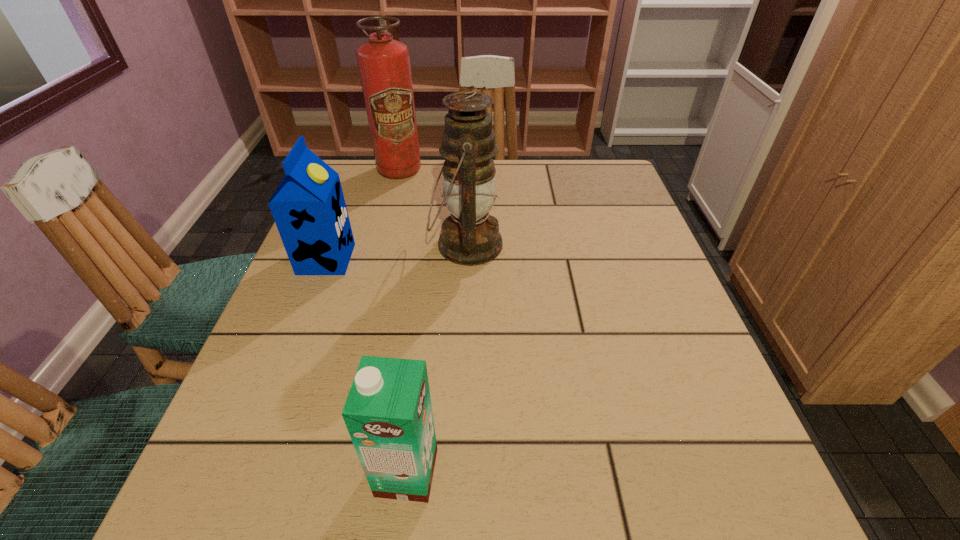
The image size is (960, 540). What are the coordinates of `object situated at the near edge` in the screenshot? It's located at (388, 413).

You are a GUI agent. You are given a task and a screenshot of the screen. Output one action in this format:
    pyautogui.click(x=<x>, y=<y>)
    Task: Click on the fire extinguisher present at the left edge
    The height and width of the screenshot is (540, 960).
    Given the screenshot: What is the action you would take?
    pyautogui.click(x=384, y=65)

I want to click on carton at the left edge, so click(308, 207).

At what (x,y) coordinates should I click in order to perform the action: click on object that is at the far left corner. Please return your answer as a coordinate pair (x, y). Looking at the image, I should click on (384, 65).

Where is `free space at the far edge of the desktop`? free space at the far edge of the desktop is located at coordinates (550, 177).

Where is `vacant space at the near edge`? Image resolution: width=960 pixels, height=540 pixels. vacant space at the near edge is located at coordinates (438, 515).

The height and width of the screenshot is (540, 960). I want to click on free space at the left edge of the desktop, so click(x=252, y=381).

In the image, there is a desktop. Where is `vacant space at the right edge`? The width and height of the screenshot is (960, 540). vacant space at the right edge is located at coordinates (661, 345).

Image resolution: width=960 pixels, height=540 pixels. Identify the location of vacant space at the far left corner of the desktop. (373, 199).

Find the location of a particular element. The height and width of the screenshot is (540, 960). free space at the near left corner of the desktop is located at coordinates (279, 484).